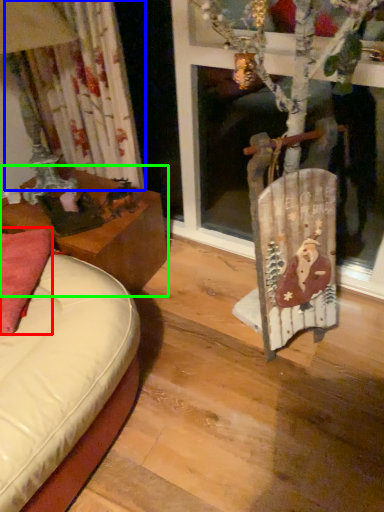
Question: Which object is positioned farthest from pillow (highlighted by a red box)? Select from curtain (highlighted by a blue box) and table (highlighted by a green box).

Choices:
 (A) curtain
 (B) table

Answer: (A)